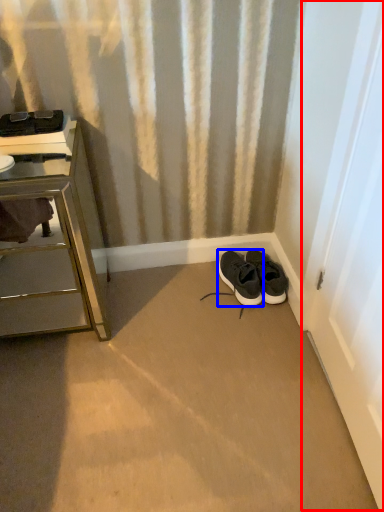
Question: Which of the following is the closest to the observer, screen door (highlighted by a red box) or shoe (highlighted by a blue box)?

Choices:
 (A) screen door
 (B) shoe

Answer: (A)